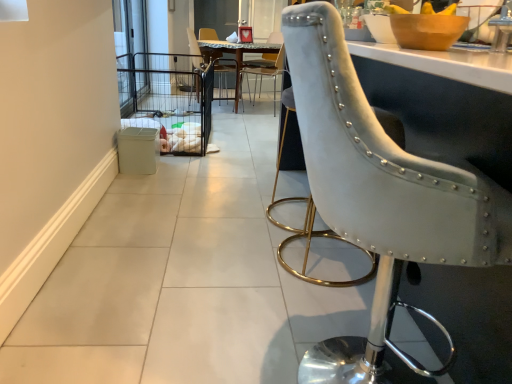
Question: Is point (137, 132) positioned closer to the camera than point (144, 39)?

Choices:
 (A) farther
 (B) closer

Answer: (B)

Question: Is white plastic trash bin at lower left to the left or to the right of clear glass screen door at upper left in the image?

Choices:
 (A) right
 (B) left

Answer: (A)

Question: Considering the real-world distances, which object is farthest from the wooden bowl at upper right?

Choices:
 (A) suede-like gray chair at right, which is counted as the 1th chair, starting from the front
 (B) metallic black chair at center, the 3th chair in the front-to-back sequence
 (C) clear glass screen door at upper left
 (D) metallic gold chair at center, which appears as the 2th chair when viewed from the front
 (E) marble top table at center

Answer: (B)

Question: Which of these objects is positioned closest to the clear glass screen door at upper left?

Choices:
 (A) white plastic trash bin at lower left
 (B) wooden bowl at upper right
 (C) metallic gold chair at center, the 2th chair in the back-to-front sequence
 (D) marble top table at center
 (E) suede-like gray chair at right, which is counted as the 1th chair, starting from the front

Answer: (A)